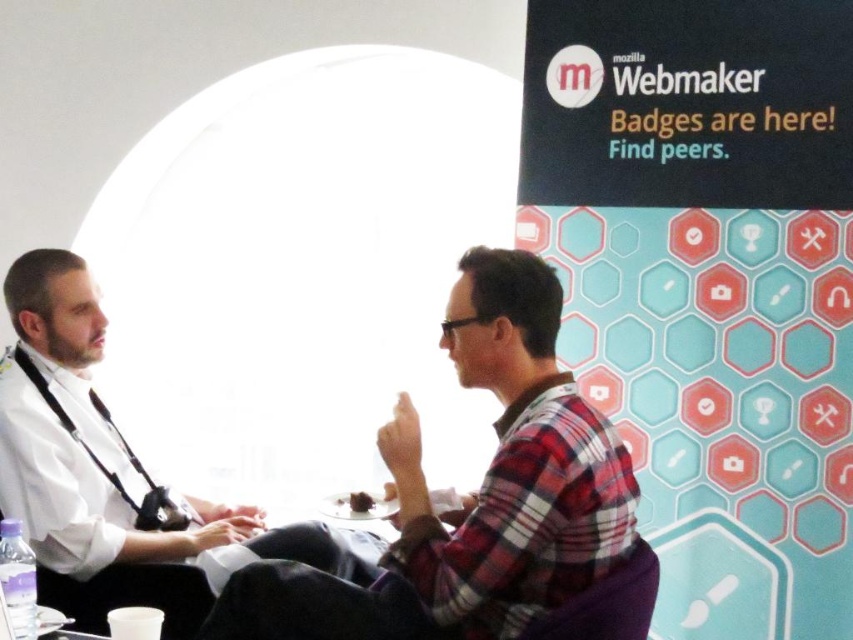
You are a photographer setting up for a group photo. You need to position the plaid fabric shirt at center and the white matte shirt at left in a line from left to right. Based on their current positions, which order should they be arranged in?

The plaid fabric shirt at center is already positioned to the right of the white matte shirt at left, so the correct order from left to right should be white matte shirt at left followed by plaid fabric shirt at center.

You are standing in front of the scene and want to locate the plaid fabric shirt at center. What are its coordinates?

The plaid fabric shirt at center is located at coordinates point (471, 493).

You are organizing a photo shoot and need to ensure that the plaid fabric shirt at center and the white matte shirt at left are visible in the frame. Given their sizes, which shirt should you focus on to ensure it doesn

The plaid fabric shirt at center is smaller than the white matte shirt at left, so you should focus on ensuring the plaid fabric shirt at center is visible since it might be harder to see due to its smaller size.